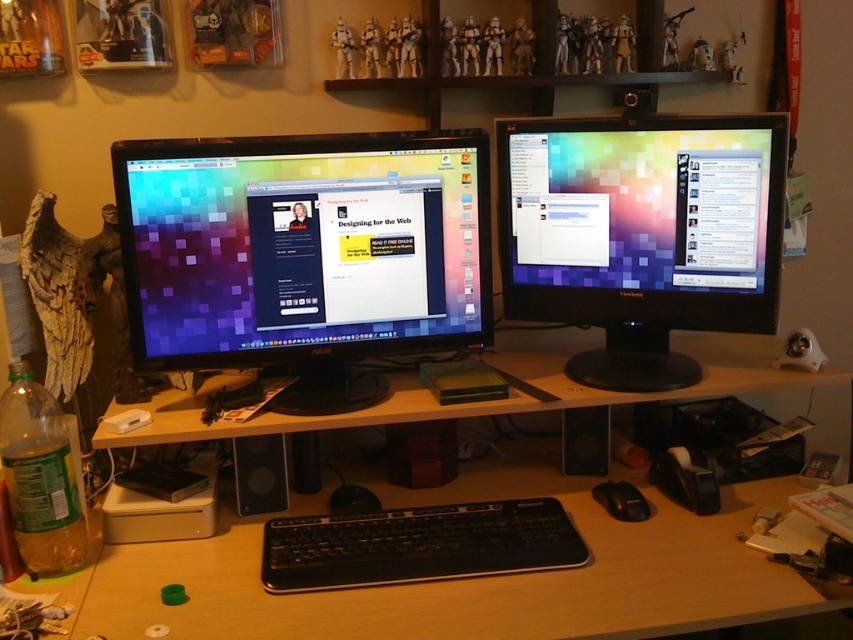
Which is in front, point (805, 380) or point (378, 180)?

Positioned in front is point (378, 180).

Image resolution: width=853 pixels, height=640 pixels. In order to click on wooden at center in this screenshot , I will do coord(463,580).

Can you confirm if matte black monitor at left is thinner than black matte mouse at center?

In fact, matte black monitor at left might be wider than black matte mouse at center.

In the scene shown: Which of these two, matte black monitor at left or black matte mouse at center, stands taller?

matte black monitor at left is taller.

Who is more distant from viewer, (467, 212) or (619, 490)?

The point (467, 212) is behind.

This screenshot has width=853, height=640. Identify the location of matte black monitor at left. (303, 244).

Does point (108, 634) lie in front of point (679, 216)?

Yes, it is.

Can you confirm if wooden at center is thinner than matte black monitor at center?

No.

Describe the element at coordinates (463, 580) in the screenshot. I see `wooden at center` at that location.

At what (x,y) coordinates should I click in order to perform the action: click on wooden at center. Please return your answer as a coordinate pair (x, y). The width and height of the screenshot is (853, 640). Looking at the image, I should click on click(x=463, y=580).